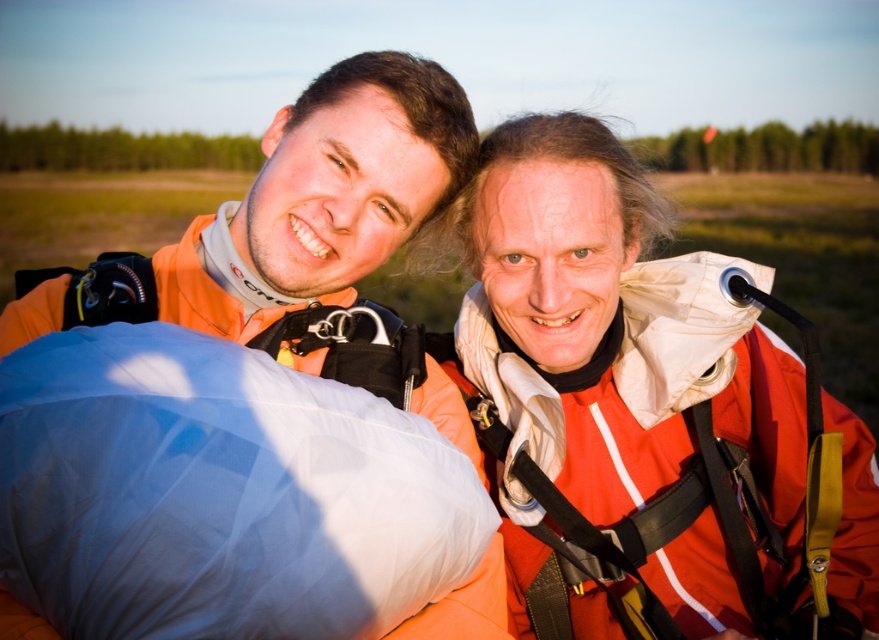
The image size is (879, 640). I want to click on matte orange jumpsuit at center, so click(x=645, y=406).

Is matte orange jumpsuit at center above blue fabric sleeping bag at lower left?

Correct, matte orange jumpsuit at center is located above blue fabric sleeping bag at lower left.

Who is more distant from viewer, (572, 113) or (356, 444)?

The point (572, 113) is more distant.

At what (x,y) coordinates should I click in order to perform the action: click on matte orange jumpsuit at center. Please return your answer as a coordinate pair (x, y). The image size is (879, 640). Looking at the image, I should click on pyautogui.click(x=645, y=406).